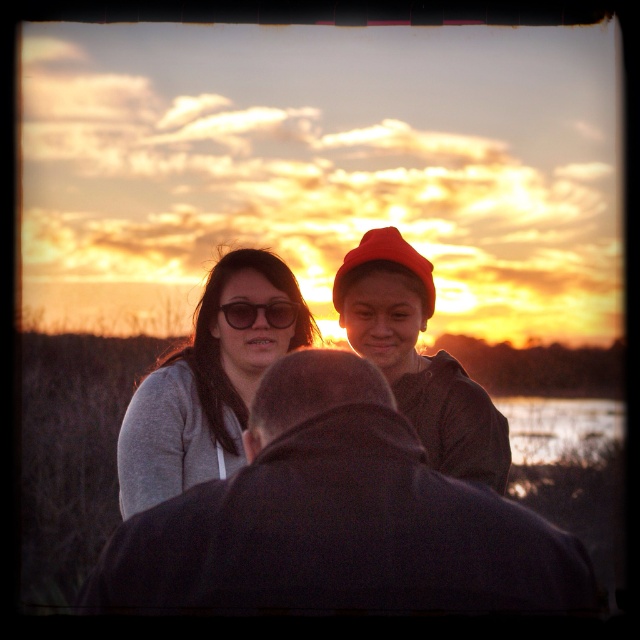
Does matte gray sweater at center have a lesser height compared to red woolen beanie at upper center?

No.

Does matte gray sweater at center have a lesser width compared to red woolen beanie at upper center?

In fact, matte gray sweater at center might be wider than red woolen beanie at upper center.

What do you see at coordinates (202, 394) in the screenshot? The image size is (640, 640). I see `matte gray sweater at center` at bounding box center [202, 394].

Where is `matte gray sweater at center`? Image resolution: width=640 pixels, height=640 pixels. matte gray sweater at center is located at coordinates (202, 394).

Which of these two, matte red beanie at center or matte black sunglasses at center, stands shorter?

matte black sunglasses at center

Between point (499, 436) and point (280, 328), which one is positioned in front?

Point (499, 436) is in front.

Find the location of `matte red beanie at center`. matte red beanie at center is located at coordinates (419, 356).

Which is below, matte gray sweater at left or red woolen beanie at upper center?

matte gray sweater at left is lower down.

Does matte gray sweater at left appear on the right side of red woolen beanie at upper center?

Incorrect, matte gray sweater at left is not on the right side of red woolen beanie at upper center.

Which is in front, point (285, 288) or point (339, 276)?

Positioned in front is point (339, 276).

Where is `matte gray sweater at left`? This screenshot has width=640, height=640. matte gray sweater at left is located at coordinates (205, 385).